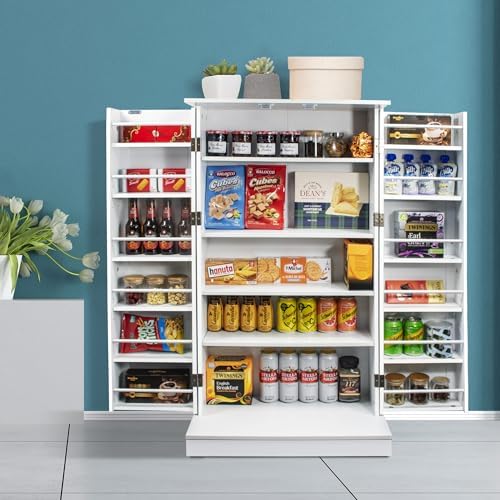
Identify the location of hinges. The width and height of the screenshot is (500, 500). (196, 147), (198, 218), (196, 381), (380, 379), (377, 218).